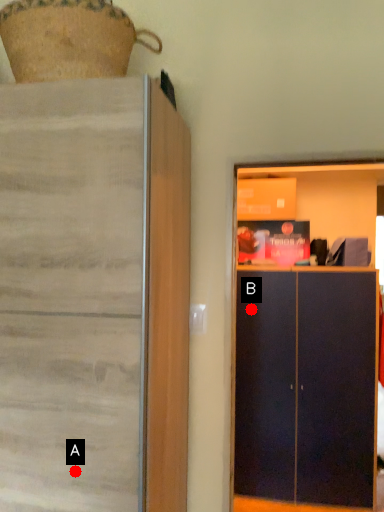
Question: Two points are circled on the image, labeled by A and B beside each circle. Which point appears farthest from the camera in this image?

Choices:
 (A) A is further
 (B) B is further

Answer: (B)